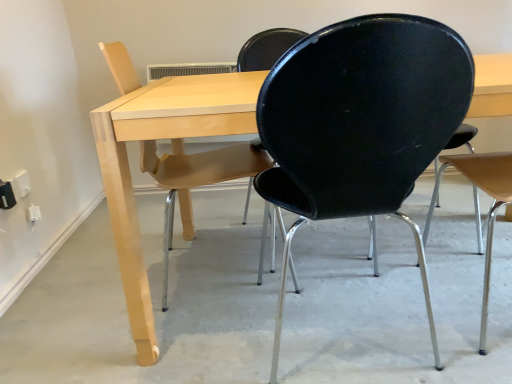
Question: Should I look upward or downward to see white plastic electric outlet at lower left?

Choices:
 (A) up
 (B) down

Answer: (A)

Question: Considering the relative positions of smooth concrete floor at center and black matte chair at right, positioned as the first chair in right-to-left order, in the image provided, is smooth concrete floor at center behind black matte chair at right, positioned as the first chair in right-to-left order,?

Choices:
 (A) no
 (B) yes

Answer: (B)

Question: Is smooth concrete floor at center to the right of black matte chair at right, acting as the 3th chair starting from the left, from the viewer's perspective?

Choices:
 (A) yes
 (B) no

Answer: (B)

Question: Is smooth concrete floor at center shorter than black matte chair at right, positioned as the first chair in right-to-left order?

Choices:
 (A) no
 (B) yes

Answer: (B)

Question: Are smooth concrete floor at center and black matte chair at right, acting as the 3th chair starting from the left, making contact?

Choices:
 (A) no
 (B) yes

Answer: (A)

Question: Would you say smooth concrete floor at center is outside black matte chair at right, acting as the 3th chair starting from the left?

Choices:
 (A) yes
 (B) no

Answer: (A)

Question: Could you tell me if smooth concrete floor at center is facing black matte chair at right, acting as the 3th chair starting from the left?

Choices:
 (A) no
 (B) yes

Answer: (A)

Question: Is matte wood chair at left, which appears as the first chair when viewed from the left, facing towards black plastic chair at center, arranged as the second chair when viewed from the right?

Choices:
 (A) no
 (B) yes

Answer: (A)

Question: Is matte wood chair at left, which appears as the first chair when viewed from the left, outside of black plastic chair at center, arranged as the second chair when viewed from the right?

Choices:
 (A) yes
 (B) no

Answer: (A)

Question: Can you confirm if matte wood chair at left, the 3th chair positioned from the right, is positioned to the right of black plastic chair at center, arranged as the second chair when viewed from the right?

Choices:
 (A) no
 (B) yes

Answer: (A)

Question: Is matte wood chair at left, which appears as the first chair when viewed from the left, further to camera compared to black plastic chair at center, arranged as the second chair when viewed from the right?

Choices:
 (A) yes
 (B) no

Answer: (A)

Question: From a real-world perspective, is matte wood chair at left, which appears as the first chair when viewed from the left, below black plastic chair at center, arranged as the second chair when viewed from the right?

Choices:
 (A) yes
 (B) no

Answer: (A)

Question: Is matte wood chair at left, which appears as the first chair when viewed from the left, smaller than black plastic chair at center, which ranks as the second chair in left-to-right order?

Choices:
 (A) yes
 (B) no

Answer: (A)

Question: Considering the relative positions of black plastic chair at center, which ranks as the second chair in left-to-right order, and light wood table at center in the image provided, is black plastic chair at center, which ranks as the second chair in left-to-right order, behind light wood table at center?

Choices:
 (A) no
 (B) yes

Answer: (A)